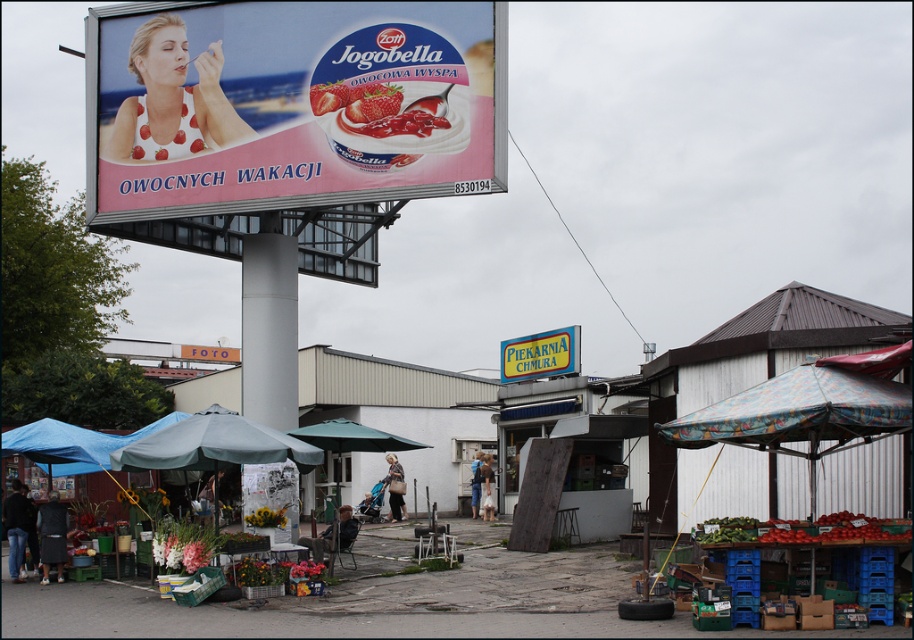
You are a photographer wanting to capture both the blue fabric umbrella at center and the orange fabric sign at center in a single frame. Based on their sizes, which object should you focus on to ensure both fit in the photo?

The blue fabric umbrella at center is smaller than the orange fabric sign at center, so focusing on the orange fabric sign at center would allow both objects to fit in the photo as the larger object requires more space.